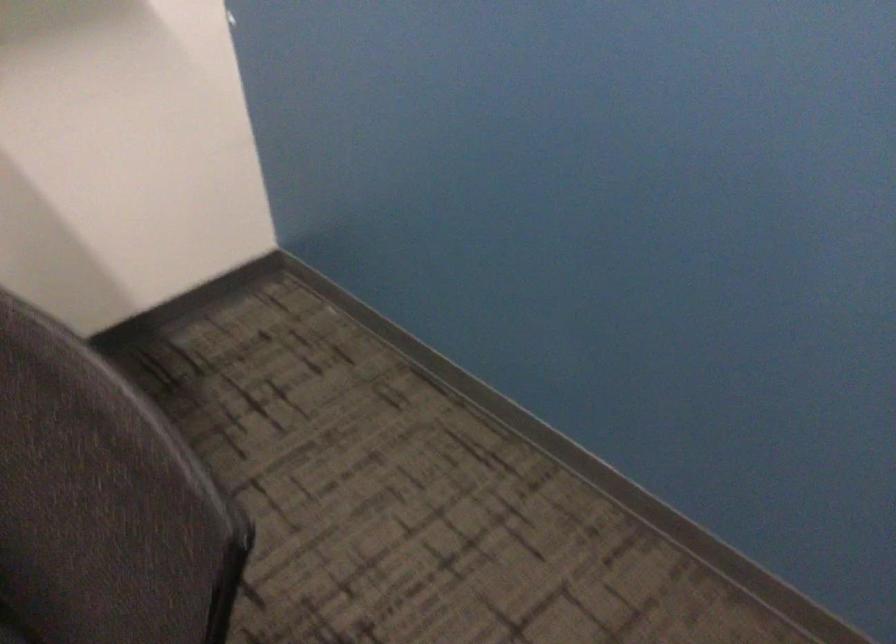
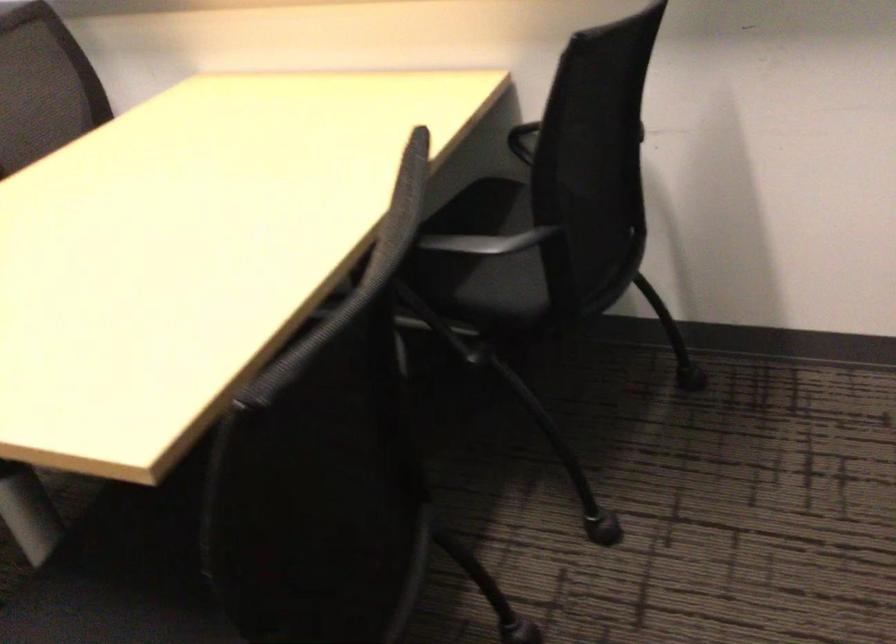
Question: The first image is from the beginning of the video and the second image is from the end. How did the camera likely rotate when shooting the video?

Choices:
 (A) Left
 (B) Right
 (C) Up
 (D) Down

Answer: (A)